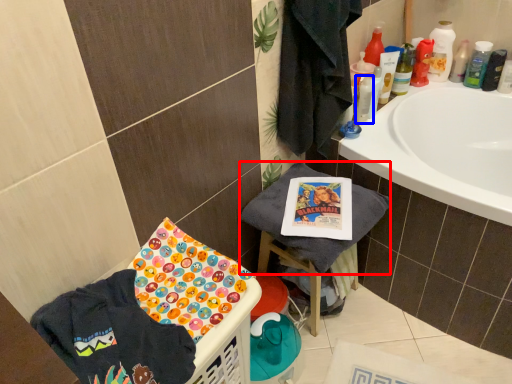
Question: Which point is closer to the camera, beach towel (highlighted by a red box) or mouthwash (highlighted by a blue box)?

Choices:
 (A) beach towel
 (B) mouthwash

Answer: (A)